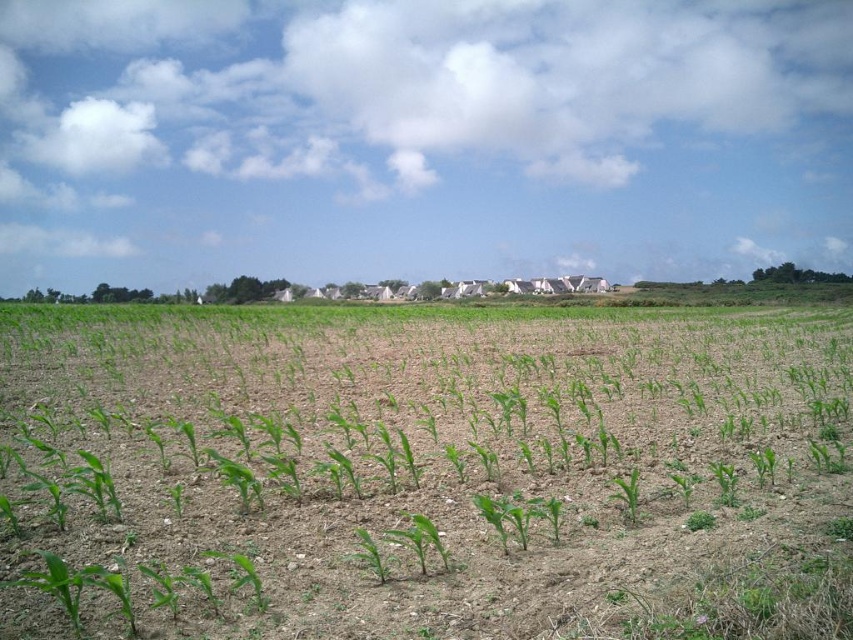
You are standing in the agricultural field and want to walk to the village houses. You have two points marked on your map, point 1 at coordinates point (602, 636) and point 2 at coordinates point (613, 499). Which point should you head towards if you want to reach the village houses first?

Point (602, 636) is closer to the viewer than point (613, 499). Therefore, you should head towards point (602, 636) to reach the village houses first as it is nearer to your current position.

You are a farmer standing at the edge of the field. You need to check both the green leafy corn at center and the green matte plant at center. Which one is farther from your current position?

The green leafy corn at center and green matte plant at center are 42.34 feet apart from each other. Since you are at the edge of the field, it is impossible to determine which one is farther without additional information about their positions relative to the edge.

You are a farmer checking the growth of your crops in the field. You notice two plants at the center of your field, the green leafy corn at center and the green matte plant at center. Which one is taller?

The green leafy corn at center is taller than the green matte plant at center.